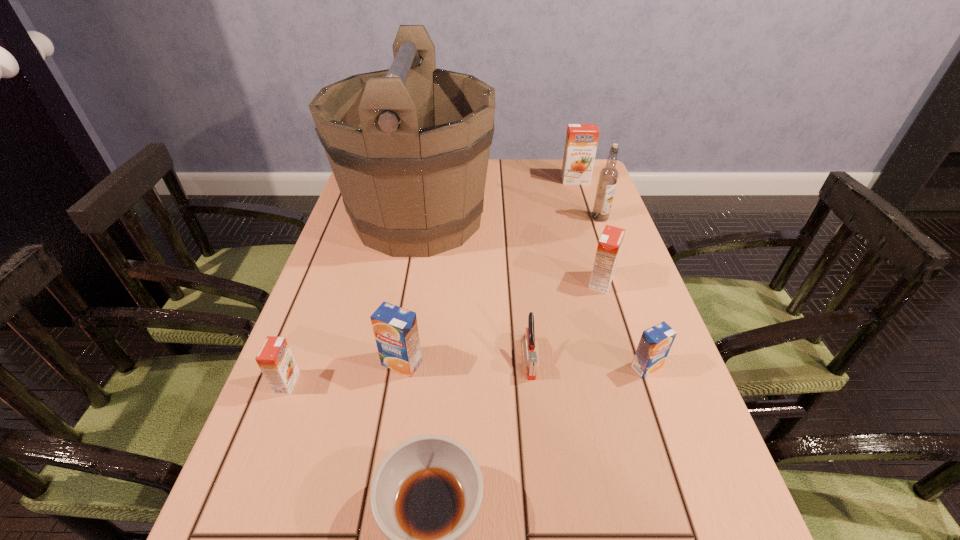
In the image, there is a desktop. In order to click on free space at the right edge in this screenshot , I will do `click(676, 533)`.

The image size is (960, 540). What are the coordinates of `blank region between the sixth nearest object and the smaller blue orange_juice` in the screenshot? It's located at (624, 325).

The image size is (960, 540). I want to click on empty space between the smaller blue orange_juice and the leftmost orange orange juice, so click(467, 375).

Locate an element on the screen. unoccupied area between the bucket and the smaller blue orange_juice is located at coordinates (x=533, y=293).

You are a GUI agent. You are given a task and a screenshot of the screen. Output one action in this format:
    pyautogui.click(x=<x>, y=<y>)
    Task: Click on the free point between the left blue orange_juice and the fourth farthest object
    The height and width of the screenshot is (540, 960).
    Given the screenshot: What is the action you would take?
    pyautogui.click(x=501, y=323)

Locate an element on the screen. Image resolution: width=960 pixels, height=540 pixels. free space between the second orange juice from left to right and the fifth object from right to left is located at coordinates (466, 360).

Where is `free point between the smaller blue orange_juice and the vodka`? This screenshot has width=960, height=540. free point between the smaller blue orange_juice and the vodka is located at coordinates (623, 292).

I want to click on free space between the smaller blue orange_juice and the second smallest orange orange juice, so (x=624, y=325).

Locate which object ranks in proximity to the smaller blue orange_juice. Please provide its 2D coordinates. Your answer should be formatted as a tuple, i.e. [(x, y)], where the tuple contains the x and y coordinates of a point satisfying the conditions above.

[(609, 245)]

I want to click on the eighth closest object to the bigger blue orange_juice, so click(x=581, y=142).